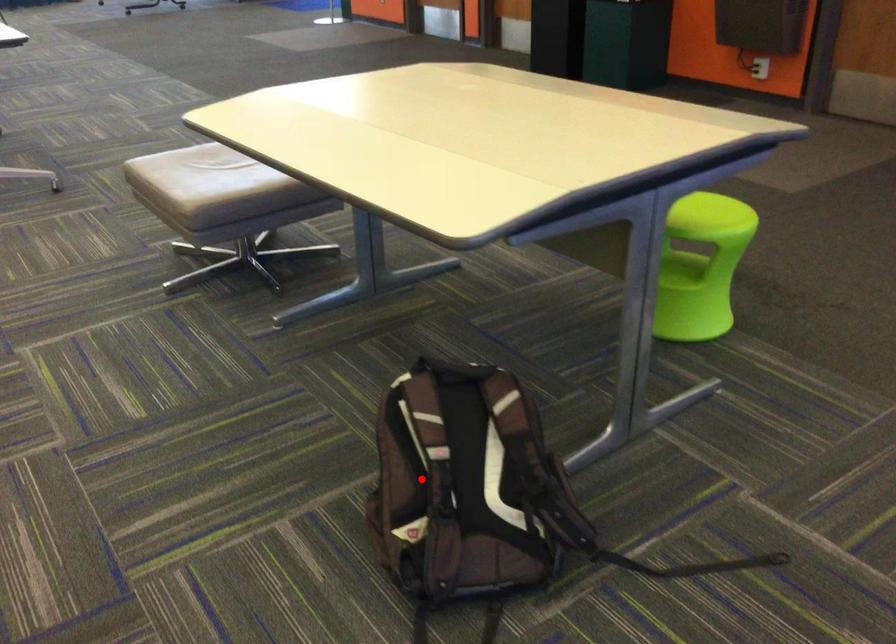
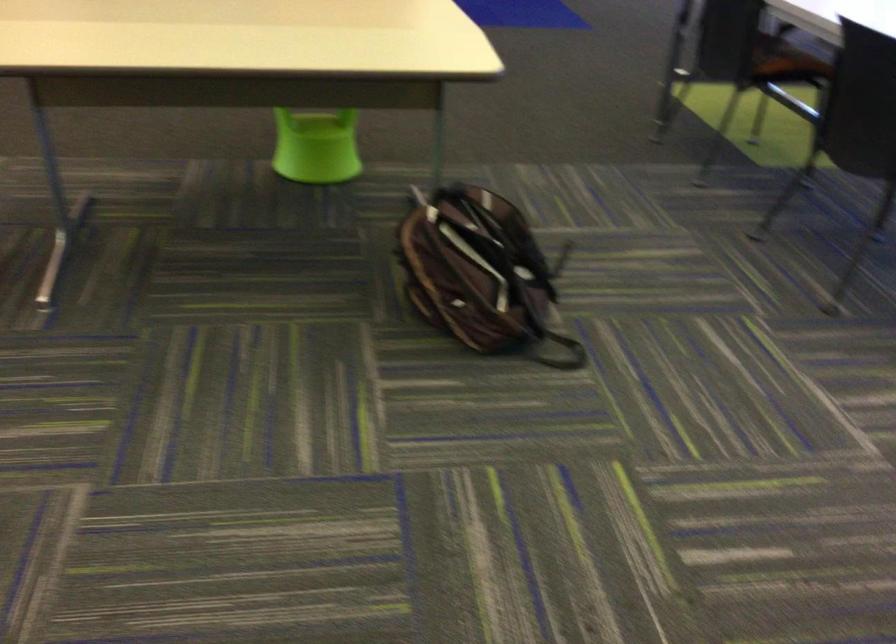
Find the pixel in the second image that matches the highlighted location in the first image.

(479, 272)